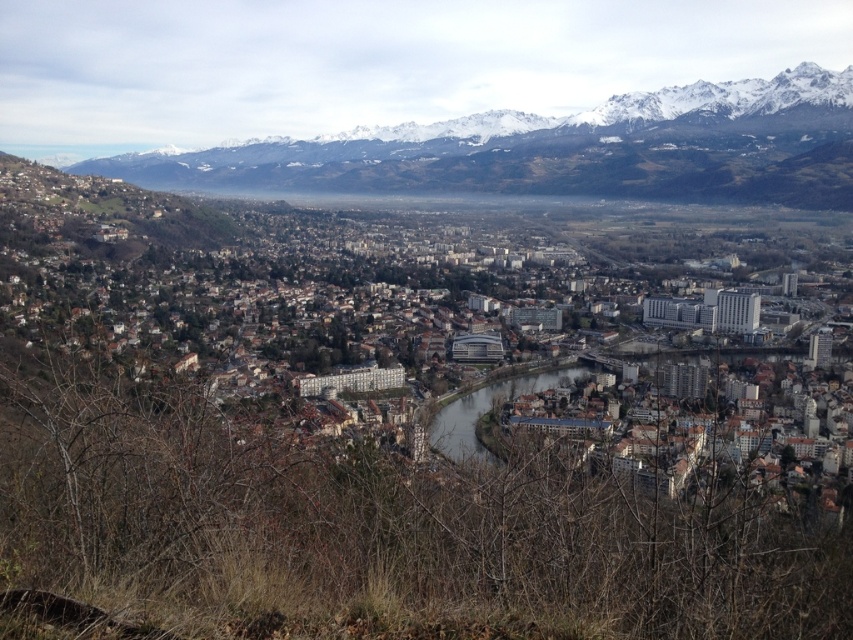
Is snowy mountain range at upper center closer to camera compared to brown concrete river at center?

That is False.

Is snowy mountain range at upper center taller than brown concrete river at center?

Yes, snowy mountain range at upper center is taller than brown concrete river at center.

What do you see at coordinates (569, 148) in the screenshot? I see `snowy mountain range at upper center` at bounding box center [569, 148].

The height and width of the screenshot is (640, 853). Identify the location of snowy mountain range at upper center. (569, 148).